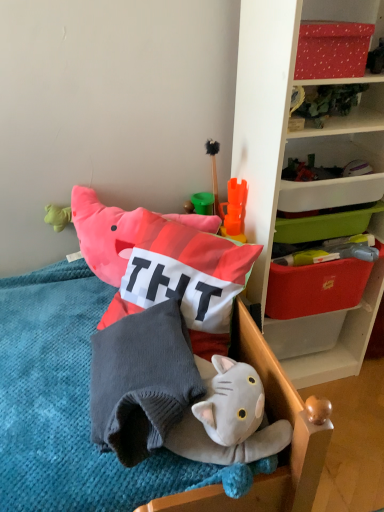
Question: From the image's perspective, is wooden chair at lower center positioned above or below red dotted fabric at upper right, positioned as the first storage box in top-to-bottom order?

Choices:
 (A) above
 (B) below

Answer: (B)

Question: Is wooden chair at lower center inside the boundaries of red dotted fabric at upper right, which is the 3th storage box from bottom to top, or outside?

Choices:
 (A) inside
 (B) outside

Answer: (B)

Question: Which of these objects is positioned closest to the soft cotton pillow at center?

Choices:
 (A) wooden chair at lower center
 (B) red plastic storage box at upper right, which is counted as the 3th storage box, starting from the top
 (C) red dotted fabric at upper right, positioned as the first storage box in top-to-bottom order
 (D) orange plastic storage box at upper right, which is the second storage box from top to bottom
 (E) gray knitted pillow at center

Answer: (A)

Question: Which of these objects is positioned farthest from the gray knitted pillow at center?

Choices:
 (A) orange plastic storage box at upper right, acting as the second storage box starting from the bottom
 (B) red plastic storage box at upper right, which appears as the first storage box when ordered from the bottom
 (C) red dotted fabric at upper right, positioned as the first storage box in top-to-bottom order
 (D) wooden chair at lower center
 (E) soft cotton pillow at center

Answer: (C)